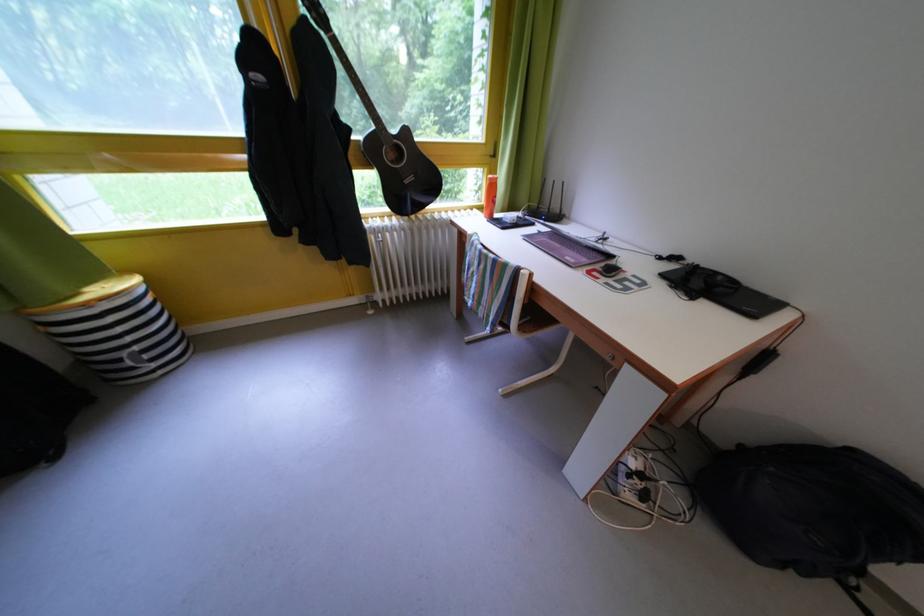
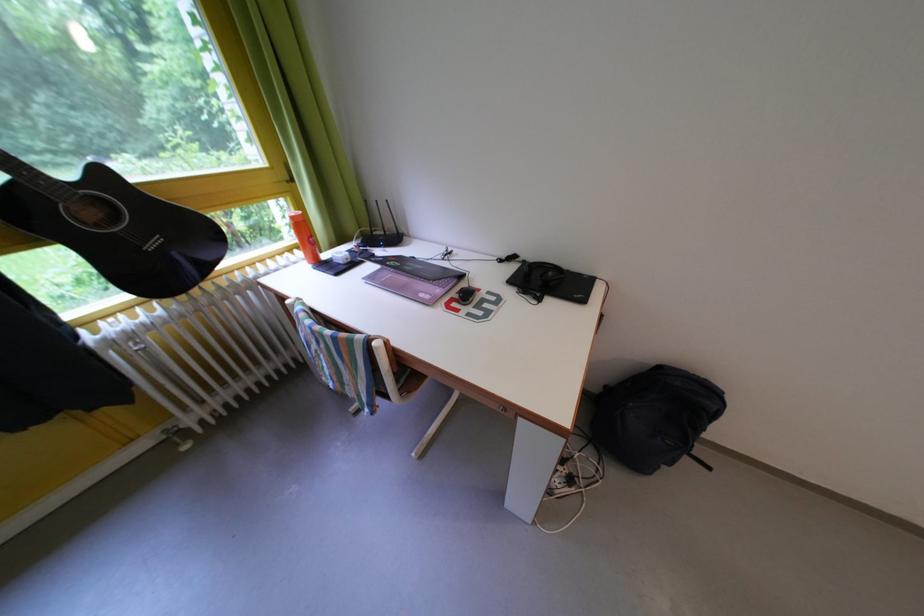
Find the pixel in the second image that matches pixel 483 216 in the first image.

(305, 257)